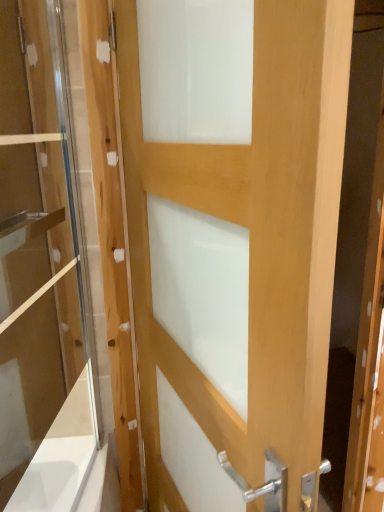
Question: Does point (13, 390) appear closer or farther from the camera than point (263, 296)?

Choices:
 (A) farther
 (B) closer

Answer: (A)

Question: Is clear glass door at left wider or thinner than natural wood door at center?

Choices:
 (A) thin
 (B) wide

Answer: (A)

Question: Considering the positions of clear glass door at left and natural wood door at center in the image, is clear glass door at left bigger or smaller than natural wood door at center?

Choices:
 (A) big
 (B) small

Answer: (B)

Question: Is natural wood door at center taller or shorter than clear glass door at left?

Choices:
 (A) short
 (B) tall

Answer: (B)

Question: Is natural wood door at center inside the boundaries of clear glass door at left, or outside?

Choices:
 (A) outside
 (B) inside

Answer: (A)

Question: From a real-world perspective, relative to clear glass door at left, is natural wood door at center vertically above or below?

Choices:
 (A) below
 (B) above

Answer: (A)

Question: Based on their sizes in the image, would you say natural wood door at center is bigger or smaller than clear glass door at left?

Choices:
 (A) big
 (B) small

Answer: (A)